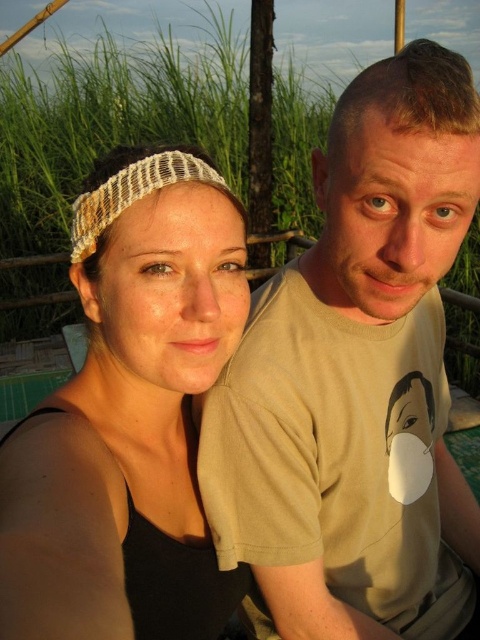
Can you confirm if matte beige t-shirt at right is positioned to the right of matte woven headband at center?

Yes, matte beige t-shirt at right is to the right of matte woven headband at center.

Who is positioned more to the right, matte beige t-shirt at right or matte woven headband at center?

matte beige t-shirt at right is more to the right.

Which is in front, point (448, 504) or point (201, 196)?

Point (201, 196) is more forward.

I want to click on matte beige t-shirt at right, so click(358, 381).